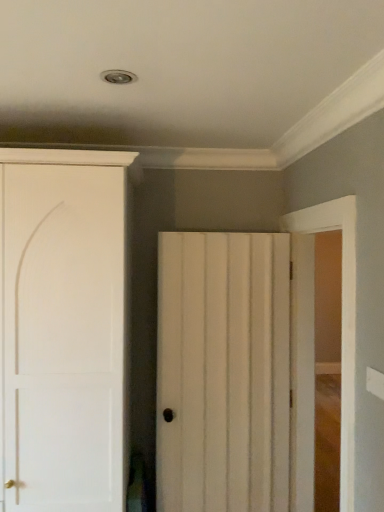
Find the location of a particular element. This screenshot has width=384, height=512. white matte door at left, which ranks as the first door in left-to-right order is located at coordinates (63, 327).

What do you see at coordinates (63, 327) in the screenshot? This screenshot has width=384, height=512. I see `white matte door at left, which ranks as the first door in left-to-right order` at bounding box center [63, 327].

The image size is (384, 512). Describe the element at coordinates (223, 372) in the screenshot. I see `white wood door at center, arranged as the 1th door when viewed from the right` at that location.

Find the location of a particular element. Image resolution: width=384 pixels, height=512 pixels. white wood door at center, arranged as the 1th door when viewed from the right is located at coordinates pyautogui.click(x=223, y=372).

Image resolution: width=384 pixels, height=512 pixels. In order to click on white matte door at left, the second door positioned from the right in this screenshot , I will do `click(63, 327)`.

Is white wood door at center, arranged as the 2th door when viewed from the left, to the left or to the right of white matte door at left, the second door positioned from the right, in the image?

Based on their positions, white wood door at center, arranged as the 2th door when viewed from the left, is located to the right of white matte door at left, the second door positioned from the right.

Relative to white matte door at left, which ranks as the first door in left-to-right order, is white wood door at center, arranged as the 2th door when viewed from the left, in front or behind?

In the image, white wood door at center, arranged as the 2th door when viewed from the left, appears behind white matte door at left, which ranks as the first door in left-to-right order.

Which is nearer, (269,396) or (30,472)?

Point (269,396) appears to be farther away from the viewer than point (30,472).

From the image's perspective, relative to white matte door at left, the second door positioned from the right, is white wood door at center, arranged as the 1th door when viewed from the right, above or below?

Based on their image positions, white wood door at center, arranged as the 1th door when viewed from the right, is located beneath white matte door at left, the second door positioned from the right.

From a real-world perspective, between white wood door at center, arranged as the 1th door when viewed from the right, and white matte door at left, which ranks as the first door in left-to-right order, who is vertically higher?

white matte door at left, which ranks as the first door in left-to-right order, from a real-world perspective.

Considering the sizes of white wood door at center, arranged as the 2th door when viewed from the left, and white matte door at left, which ranks as the first door in left-to-right order, in the image, is white wood door at center, arranged as the 2th door when viewed from the left, wider or thinner than white matte door at left, which ranks as the first door in left-to-right order,?

white wood door at center, arranged as the 2th door when viewed from the left, is thinner than white matte door at left, which ranks as the first door in left-to-right order.

Considering the sizes of objects white wood door at center, arranged as the 2th door when viewed from the left, and white matte door at left, which ranks as the first door in left-to-right order, in the image provided, who is shorter, white wood door at center, arranged as the 2th door when viewed from the left, or white matte door at left, which ranks as the first door in left-to-right order,?

Standing shorter between the two is white wood door at center, arranged as the 2th door when viewed from the left.

Considering the sizes of objects white wood door at center, arranged as the 1th door when viewed from the right, and white matte door at left, which ranks as the first door in left-to-right order, in the image provided, who is bigger, white wood door at center, arranged as the 1th door when viewed from the right, or white matte door at left, which ranks as the first door in left-to-right order,?

With larger size is white matte door at left, which ranks as the first door in left-to-right order.

Would you say white wood door at center, arranged as the 2th door when viewed from the left, contains white matte door at left, the second door positioned from the right?

That's incorrect, white matte door at left, the second door positioned from the right, is not inside white wood door at center, arranged as the 2th door when viewed from the left.

Is white wood door at center, arranged as the 2th door when viewed from the left, with white matte door at left, the second door positioned from the right?

white wood door at center, arranged as the 2th door when viewed from the left, and white matte door at left, the second door positioned from the right, are clearly separated.

Is white wood door at center, arranged as the 2th door when viewed from the left, looking in the opposite direction of white matte door at left, which ranks as the first door in left-to-right order?

No.

How different are the orientations of white wood door at center, arranged as the 2th door when viewed from the left, and white matte door at left, the second door positioned from the right, in degrees?

There is a 4.56-degree angle between the facing directions of white wood door at center, arranged as the 2th door when viewed from the left, and white matte door at left, the second door positioned from the right.

Image resolution: width=384 pixels, height=512 pixels. I want to click on door in front of the white wood door at center, arranged as the 2th door when viewed from the left, so click(x=63, y=327).

Considering the relative positions of white matte door at left, which ranks as the first door in left-to-right order, and white wood door at center, arranged as the 1th door when viewed from the right, in the image provided, is white matte door at left, which ranks as the first door in left-to-right order, to the left of white wood door at center, arranged as the 1th door when viewed from the right, from the viewer's perspective?

Correct, you'll find white matte door at left, which ranks as the first door in left-to-right order, to the left of white wood door at center, arranged as the 1th door when viewed from the right.

From the picture: Which is in front, white matte door at left, the second door positioned from the right, or white wood door at center, arranged as the 1th door when viewed from the right?

white matte door at left, the second door positioned from the right.

Considering the points (115, 168) and (218, 243), which point is behind, point (115, 168) or point (218, 243)?

The point (218, 243) is farther from the camera.

From the image's perspective, is white matte door at left, which ranks as the first door in left-to-right order, below white wood door at center, arranged as the 2th door when viewed from the left?

No, from the image's perspective, white matte door at left, which ranks as the first door in left-to-right order, is not beneath white wood door at center, arranged as the 2th door when viewed from the left.

Consider the image. From a real-world perspective, does white matte door at left, which ranks as the first door in left-to-right order, stand above white wood door at center, arranged as the 1th door when viewed from the right?

Yes, from a real-world perspective, white matte door at left, which ranks as the first door in left-to-right order, is on top of white wood door at center, arranged as the 1th door when viewed from the right.

Based on the photo, between white matte door at left, the second door positioned from the right, and white wood door at center, arranged as the 2th door when viewed from the left, which one has smaller width?

Thinner between the two is white wood door at center, arranged as the 2th door when viewed from the left.

Considering the relative sizes of white matte door at left, which ranks as the first door in left-to-right order, and white wood door at center, arranged as the 2th door when viewed from the left, in the image provided, is white matte door at left, which ranks as the first door in left-to-right order, shorter than white wood door at center, arranged as the 2th door when viewed from the left,?

In fact, white matte door at left, which ranks as the first door in left-to-right order, may be taller than white wood door at center, arranged as the 2th door when viewed from the left.

Between white matte door at left, the second door positioned from the right, and white wood door at center, arranged as the 1th door when viewed from the right, which one has larger size?

white matte door at left, the second door positioned from the right.

Is white wood door at center, arranged as the 1th door when viewed from the right, inside white matte door at left, the second door positioned from the right?

No, white wood door at center, arranged as the 1th door when viewed from the right, is not a part of white matte door at left, the second door positioned from the right.

Could you tell me if white matte door at left, which ranks as the first door in left-to-right order, is facing white wood door at center, arranged as the 2th door when viewed from the left?

No, white matte door at left, which ranks as the first door in left-to-right order, is not aimed at white wood door at center, arranged as the 2th door when viewed from the left.

Measure the distance from white matte door at left, the second door positioned from the right, to white wood door at center, arranged as the 1th door when viewed from the right.

The distance of white matte door at left, the second door positioned from the right, from white wood door at center, arranged as the 1th door when viewed from the right, is 26.68 inches.

Where is `door on the left of white wood door at center, arranged as the 2th door when viewed from the left`? The image size is (384, 512). door on the left of white wood door at center, arranged as the 2th door when viewed from the left is located at coordinates (63, 327).

The height and width of the screenshot is (512, 384). I want to click on door that is in front of the white wood door at center, arranged as the 2th door when viewed from the left, so click(63, 327).

This screenshot has width=384, height=512. What are the coordinates of `door below the white matte door at left, the second door positioned from the right (from a real-world perspective)` in the screenshot? It's located at (223, 372).